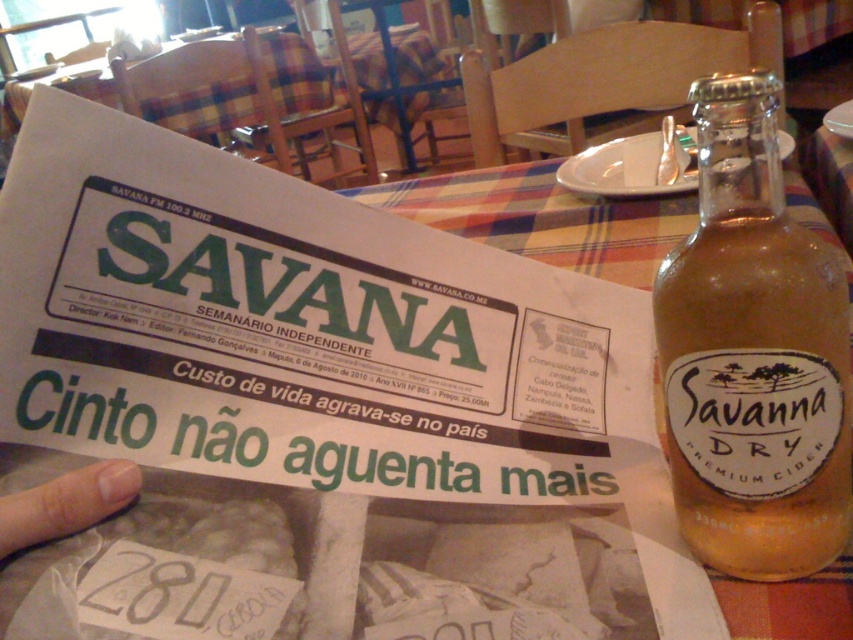
What object is located at the coordinates point (753, 355)?

The translucent glass bottle at upper right is located at point (753, 355).

What is located at the coordinates point (204, 106)?

At point (204, 106) lies plaid fabric table at upper center.